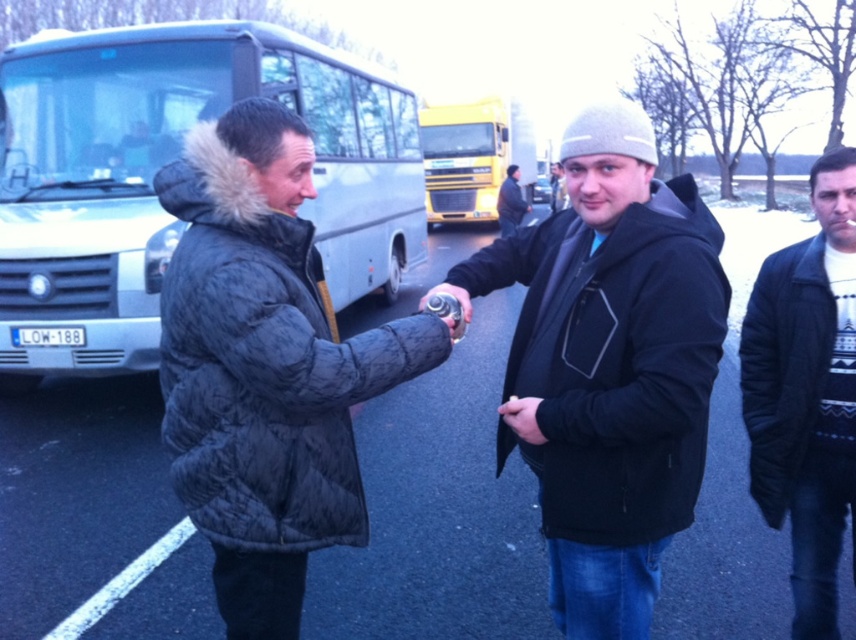
You are a photographer trying to capture a portrait of both the black fleece jacket at center and the dark gray knit hat at center in the same frame. Based on their positions, which object should you focus on first to ensure both are in focus?

The black fleece jacket at center is positioned under dark gray knit hat at center, so you should focus on the dark gray knit hat at center first to ensure both are in focus.